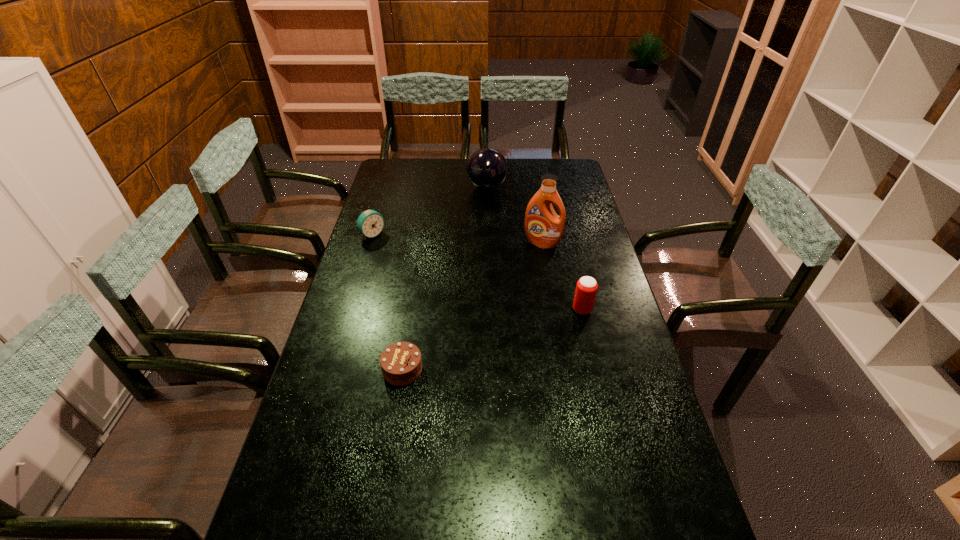
Identify the location of the second object from left to right. (401, 364).

The image size is (960, 540). I want to click on the shortest object, so tap(401, 364).

This screenshot has height=540, width=960. Identify the location of beer can. (586, 288).

You are a GUI agent. You are given a task and a screenshot of the screen. Output one action in this format:
    pyautogui.click(x=<x>, y=<y>)
    Task: Click on the third object from left to right
    
    Given the screenshot: What is the action you would take?
    pyautogui.click(x=487, y=168)

Find the location of a particular element. the fourth shortest object is located at coordinates (487, 168).

Locate an element on the screen. The width and height of the screenshot is (960, 540). the leftmost object is located at coordinates (370, 223).

This screenshot has height=540, width=960. What are the coordinates of `detergent` in the screenshot? It's located at point(544,228).

The width and height of the screenshot is (960, 540). Identify the location of free region located 0.370m on the front of the nearest object. (376, 536).

Locate an element on the screen. Image resolution: width=960 pixels, height=540 pixels. blank space located on the left of the beer can is located at coordinates 476,309.

Where is `free spot located 0.330m on the side of the farthest object with the finger holes`? The image size is (960, 540). free spot located 0.330m on the side of the farthest object with the finger holes is located at coordinates (488, 245).